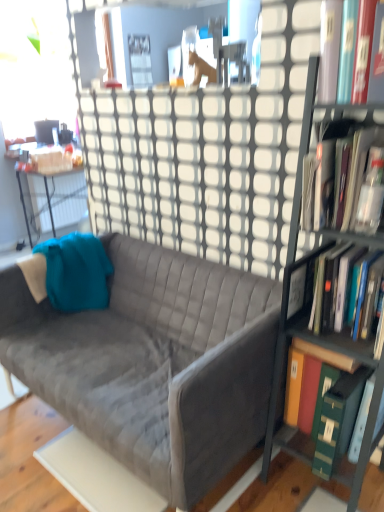
Locate an element on the screen. The image size is (384, 512). free location above teal fabric throw pillow at left (from a real-world perspective) is located at coordinates 55,245.